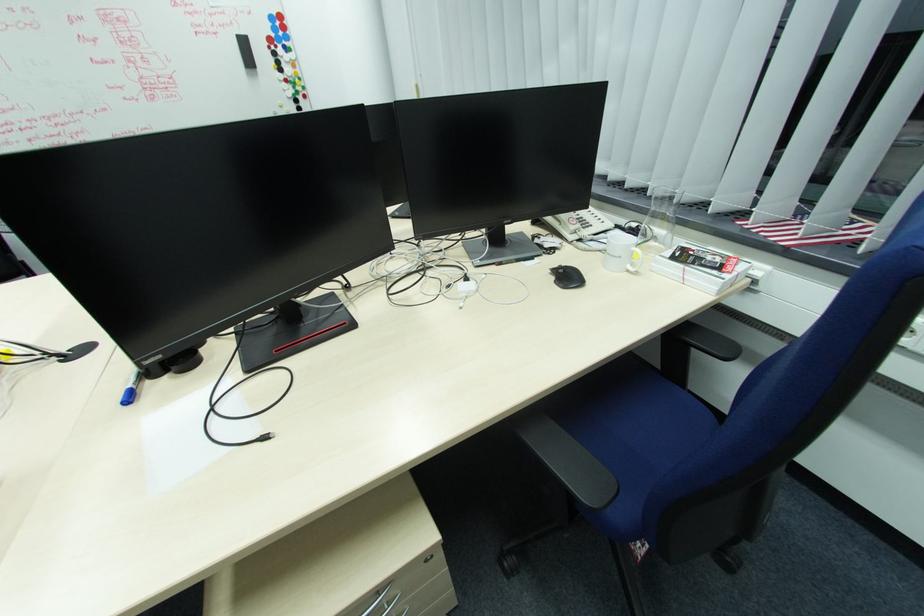
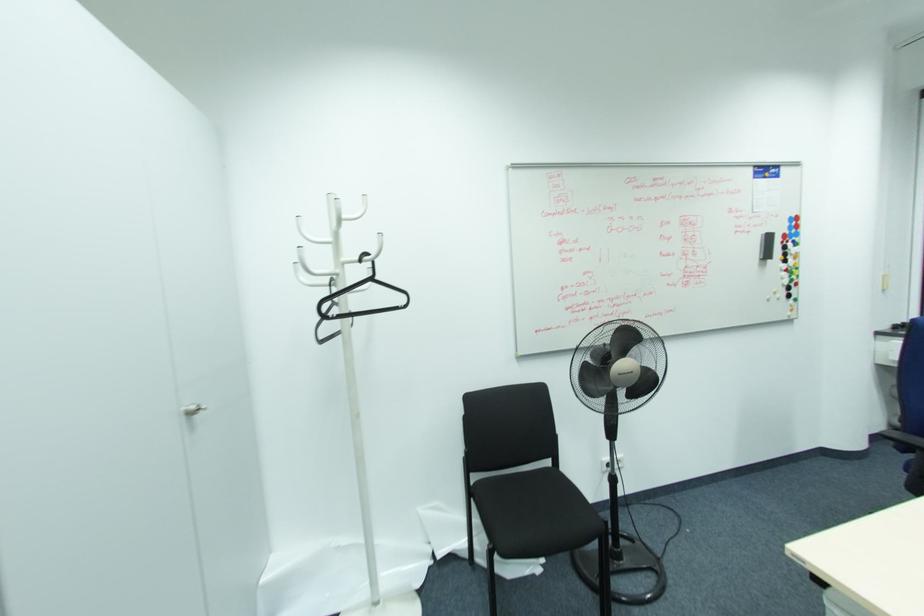
Where in the second image is the point corresponding to [274,54] from the first image?

(785, 248)